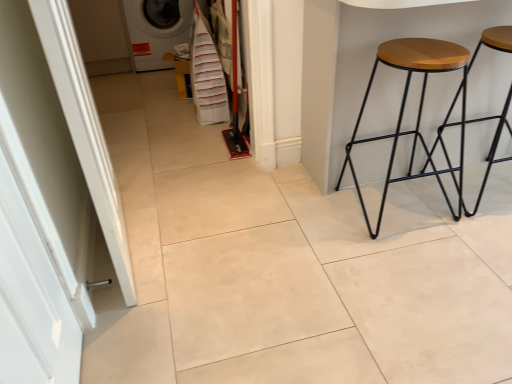
Where is `free space that is in between white glossy door at left and wooden/black metal stool at right, which is counted as the 1th stool, starting from the left`? The image size is (512, 384). free space that is in between white glossy door at left and wooden/black metal stool at right, which is counted as the 1th stool, starting from the left is located at coordinates (278, 286).